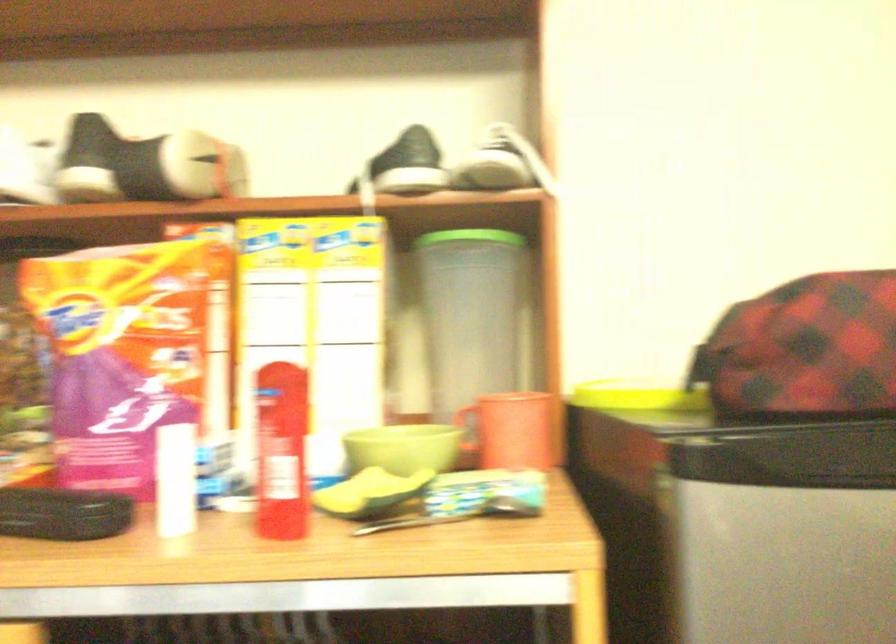
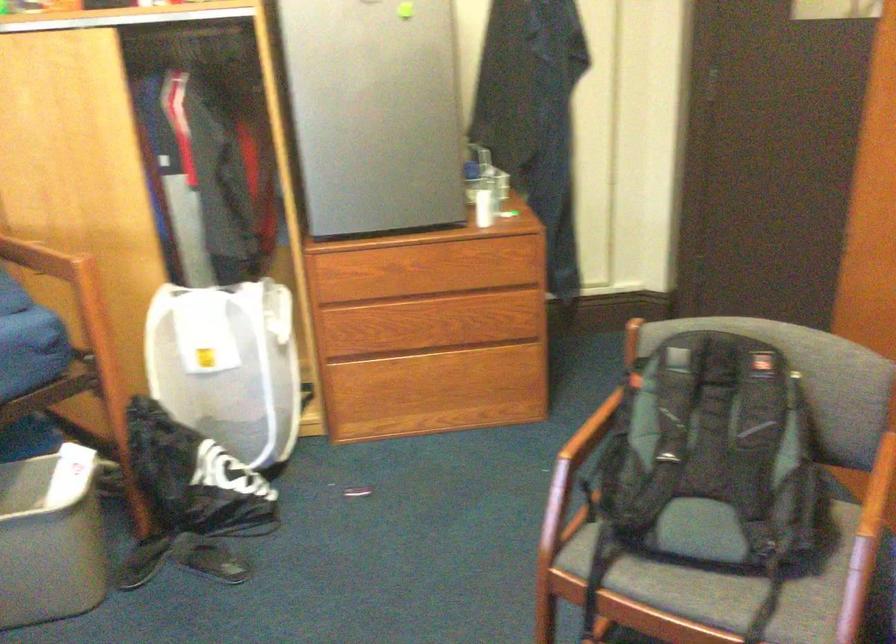
Question: Which direction would the cameraman need to move to produce the second image? Reply with the corresponding letter.

Choices:
 (A) Left
 (B) Right
 (C) Forward
 (D) Backward

Answer: (D)